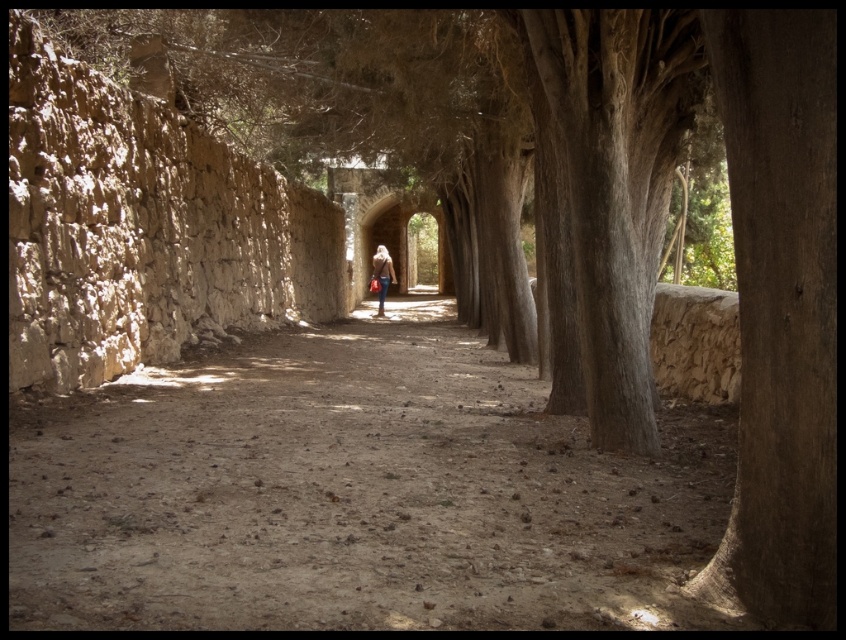
Question: Which point appears farthest from the camera in this image?

Choices:
 (A) (x=371, y=275)
 (B) (x=308, y=595)

Answer: (A)

Question: Can you confirm if dirt ground at center is thinner than denim jacket at center?

Choices:
 (A) yes
 (B) no

Answer: (B)

Question: Does dirt ground at center have a lesser width compared to denim jacket at center?

Choices:
 (A) no
 (B) yes

Answer: (A)

Question: Which of the following is the farthest from the observer?

Choices:
 (A) dirt ground at center
 (B) denim jacket at center

Answer: (B)

Question: From the image, what is the correct spatial relationship of dirt ground at center in relation to denim jacket at center?

Choices:
 (A) above
 (B) below

Answer: (B)